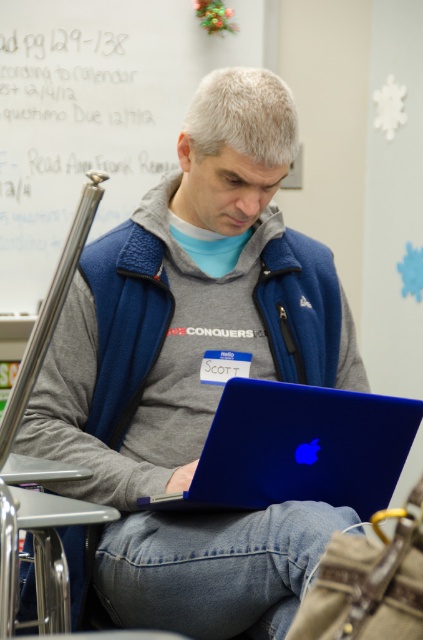
Question: Is whiteboard at upper left closer to camera compared to blue glossy laptop at center?

Choices:
 (A) yes
 (B) no

Answer: (B)

Question: Among these points, which one is farthest from the camera?

Choices:
 (A) click(x=74, y=88)
 (B) click(x=382, y=497)

Answer: (A)

Question: Observing the image, what is the correct spatial positioning of whiteboard at upper left in reference to blue glossy laptop at center?

Choices:
 (A) right
 (B) left

Answer: (B)

Question: Is whiteboard at upper left thinner than blue glossy laptop at center?

Choices:
 (A) yes
 (B) no

Answer: (B)

Question: Which object is closer to the camera taking this photo?

Choices:
 (A) whiteboard at upper left
 (B) blue glossy laptop at center

Answer: (B)